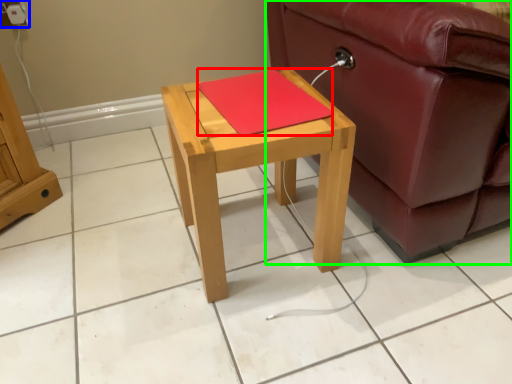
Question: Considering the real-world distances, which object is closest to pad (highlighted by a red box)? electric outlet (highlighted by a blue box) or studio couch (highlighted by a green box).

Choices:
 (A) electric outlet
 (B) studio couch

Answer: (B)